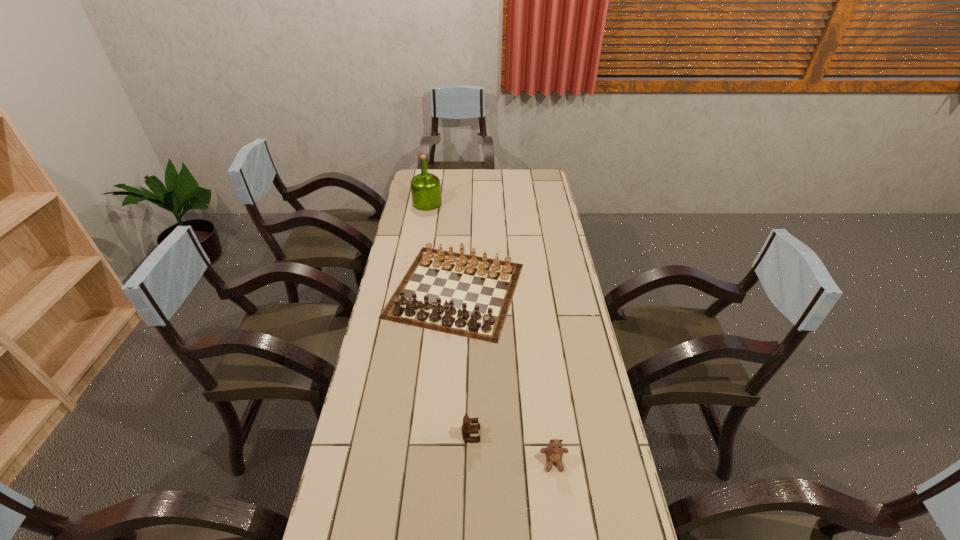
Find the location of a particular element. The width and height of the screenshot is (960, 540). blank space located 0.350m on the face of the second nearest object is located at coordinates (605, 434).

Identify the location of olive oil present at the left edge. (425, 187).

Locate an element on the screen. chessboard at the left edge is located at coordinates (459, 295).

The image size is (960, 540). Find the location of `object that is at the right edge`. object that is at the right edge is located at coordinates (554, 451).

Identify the location of free space at the far edge of the desktop. (491, 173).

In order to click on free space at the left edge of the desktop in this screenshot , I will do `click(345, 471)`.

Where is `vacant region at the right edge of the desktop`? vacant region at the right edge of the desktop is located at coordinates (580, 383).

Where is `free space that is in between the second nearest object and the third nearest object`? free space that is in between the second nearest object and the third nearest object is located at coordinates (464, 362).

You are a GUI agent. You are given a task and a screenshot of the screen. Output one action in this format:
    pyautogui.click(x=<x>, y=<y>)
    Task: Click on the unoccupied position between the third nearest object and the nearer teddy bear
    The image size is (960, 540).
    Given the screenshot: What is the action you would take?
    pyautogui.click(x=505, y=376)

At what (x,y) coordinates should I click in order to perform the action: click on empty space that is in between the chessboard and the left teddy bear. Please return your answer as a coordinate pair (x, y). The image size is (960, 540). Looking at the image, I should click on (464, 362).